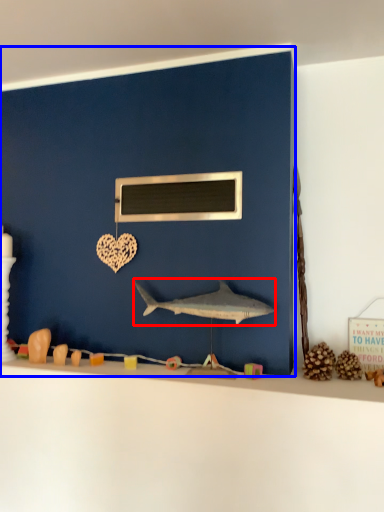
Question: Which point is closer to the camera, shark (highlighted by a red box) or backdrop (highlighted by a blue box)?

Choices:
 (A) shark
 (B) backdrop

Answer: (A)